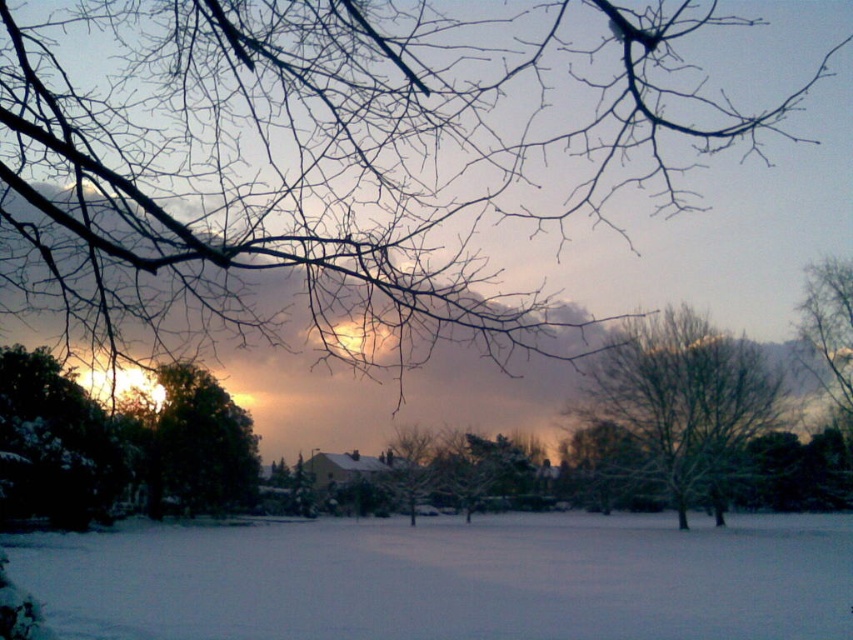
You are standing at the center of a snowfield and see a point marked at coordinates (x=331, y=156). What is located at that point?

At point (x=331, y=156) lies bare branches at upper center.

You are an artist sketching the winter scene. You want to draw the bare branches at upper center first. According to the coordinates provided, where exactly should you place them on your canvas?

The bare branches at upper center should be placed at the coordinates point (331, 156) on the canvas.